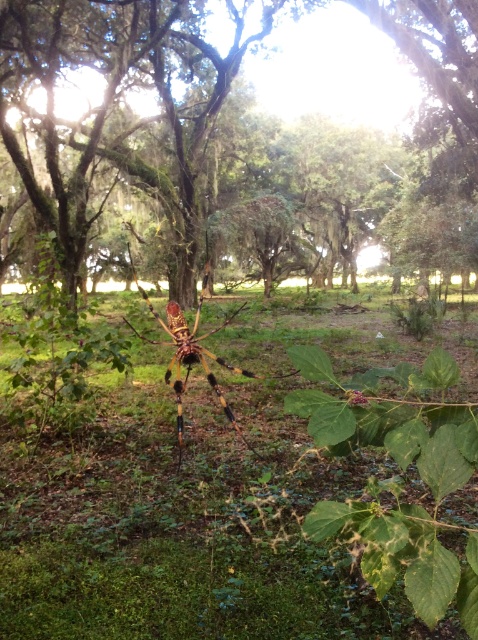
Question: Observing the image, what is the correct spatial positioning of yellow-green textured spider at center in reference to multicolored metallic garden spider at center?

Choices:
 (A) right
 (B) left

Answer: (A)

Question: Which point is closer to the camera taking this photo?

Choices:
 (A) (457, 12)
 (B) (206, 348)

Answer: (B)

Question: Is yellow-green textured spider at center smaller than multicolored metallic garden spider at center?

Choices:
 (A) no
 (B) yes

Answer: (A)

Question: Which point appears closest to the camera in this image?

Choices:
 (A) (180, 436)
 (B) (440, 29)

Answer: (A)

Question: Is the position of yellow-green textured spider at center less distant than that of multicolored metallic garden spider at center?

Choices:
 (A) no
 (B) yes

Answer: (A)